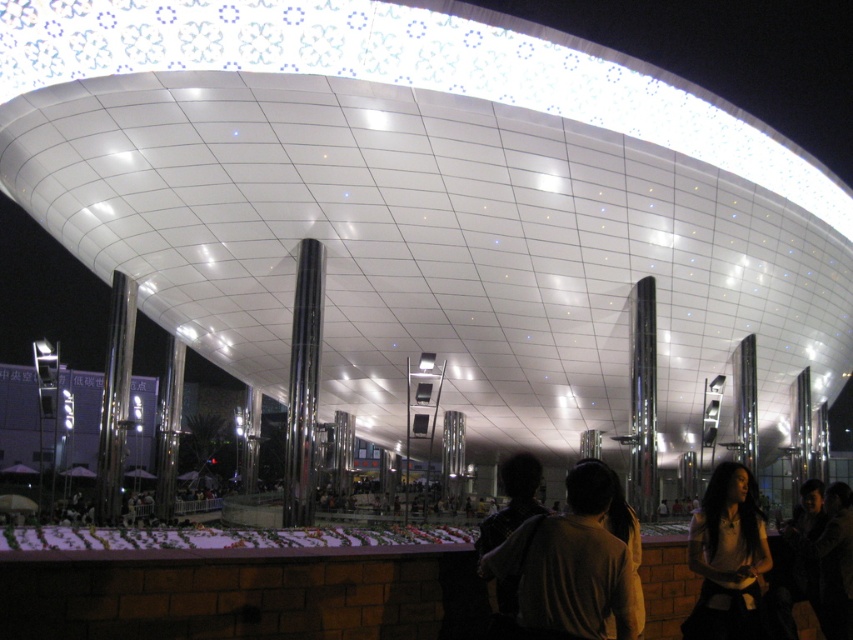
In the scene shown: You are standing at the point marked as point (531, 602) in the image. The building has a reflective roof that can be seen from various angles. If you want to take a photo of the entire curved roof without any obstructions, would your current position allow you to do so?

→ The point (531, 602) is 95.51 feet away from the viewer. Since the curved roof is reflective and the distance is sufficient, you can likely capture the entire roof without obstructions from this position.